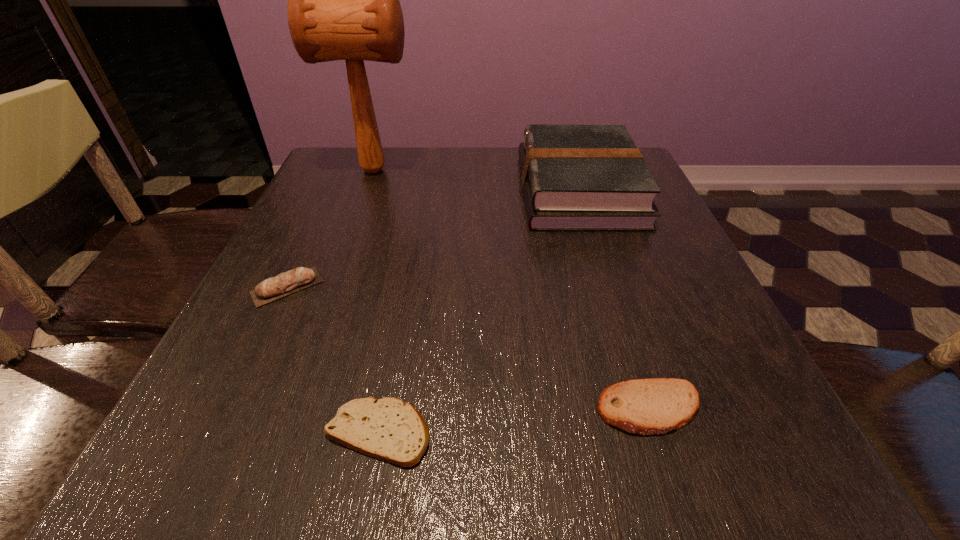
This screenshot has width=960, height=540. I want to click on pita bread present at the right edge, so click(x=653, y=406).

You are a GUI agent. You are given a task and a screenshot of the screen. Output one action in this format:
    pyautogui.click(x=<x>, y=<y>)
    Task: Click on the object that is at the far left corner
    This screenshot has width=960, height=540.
    Given the screenshot: What is the action you would take?
    pyautogui.click(x=343, y=0)

Identify the location of object that is at the far right corner. (575, 177).

The image size is (960, 540). Identify the location of object located in the near right corner section of the desktop. (653, 406).

Locate an element on the screen. free space at the far edge of the desktop is located at coordinates (410, 159).

In the image, there is a desktop. At what (x,y) coordinates should I click in order to perform the action: click on vacant space at the near edge. Please return your answer as a coordinate pair (x, y). Looking at the image, I should click on (559, 428).

The height and width of the screenshot is (540, 960). I want to click on vacant space at the left edge, so click(290, 317).

In order to click on vacant space at the right edge in this screenshot , I will do `click(766, 418)`.

In the image, there is a desktop. In order to click on free region at the far left corner in this screenshot , I will do `click(351, 147)`.

Identify the location of free point between the hardback book and the shortest pita bread. Image resolution: width=960 pixels, height=540 pixels. (479, 310).